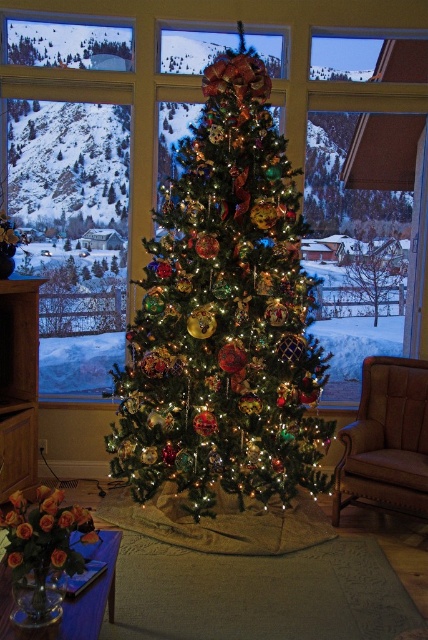
You are standing in the room with the festive Christmas tree. If you want to move closer to the shiny green christmas tree at center, which direction should you move relative to your current position?

Since the shiny green christmas tree at center is located at point [225,316], you should move forward towards the center of the room to reach it.

You are standing in the room with the green matte tree at center and the transparent glass window at center. If you want to look outside through the window, which object should you move closer to?

You should move closer to the transparent glass window at center to look outside, as it is closer to you than the green matte tree at center.

You are planning to place a large rectangular gift box in front of the transparent glass window at center and the green matte tree at center. Which object should you move to make space for the gift box?

The transparent glass window at center is wider than the green matte tree at center, so you should move the transparent glass window at center to make space for the gift box since it occupies more horizontal space.